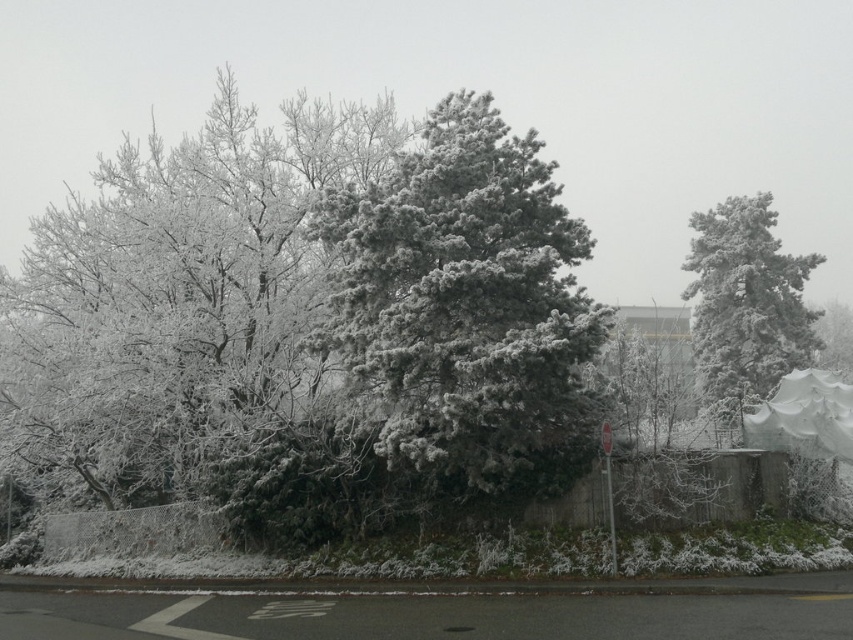
Question: Among these points, which one is farthest from the camera?

Choices:
 (A) (799, 380)
 (B) (372, 371)
 (C) (242, 316)

Answer: (A)

Question: Is white frosty tree at left smaller than snow-covered pine tree at right?

Choices:
 (A) no
 (B) yes

Answer: (A)

Question: Which point is farther to the camera?

Choices:
 (A) white frosty tree at left
 (B) snow-covered pine tree at right
 (C) white fabric canopy at lower right

Answer: (B)

Question: Which object appears farthest from the camera in this image?

Choices:
 (A) snow-covered pine tree at center
 (B) snow-covered pine tree at right
 (C) white fabric canopy at lower right

Answer: (B)

Question: Can you confirm if white frosty tree at left is smaller than white fabric canopy at lower right?

Choices:
 (A) no
 (B) yes

Answer: (A)

Question: Does snow-covered pine tree at center appear under snow-covered pine tree at right?

Choices:
 (A) yes
 (B) no

Answer: (A)